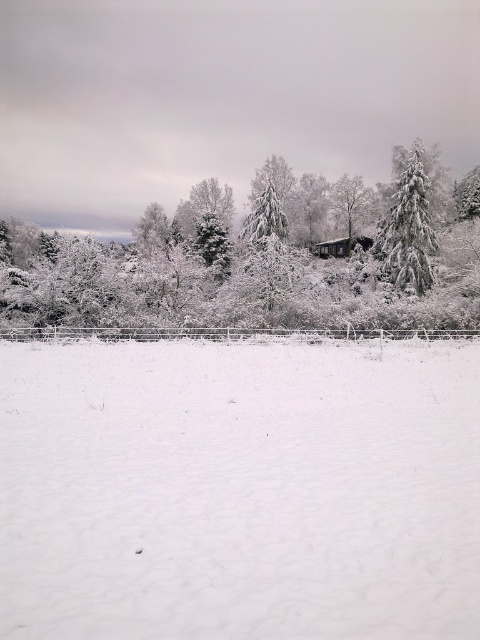
Question: Which point is closer to the camera?

Choices:
 (A) white frosty tree at upper center
 (B) snow-covered evergreen at right
 (C) white fluffy snow at center

Answer: (C)

Question: Which point is closer to the camera taking this photo?

Choices:
 (A) (427, 244)
 (B) (257, 324)

Answer: (B)

Question: Is white frosty tree at upper center to the right of snow-covered evergreen at right from the viewer's perspective?

Choices:
 (A) no
 (B) yes

Answer: (A)

Question: Is white fluffy snow at center to the left of snow-covered evergreen at right from the viewer's perspective?

Choices:
 (A) no
 (B) yes

Answer: (B)

Question: Which point is farther to the camera?

Choices:
 (A) click(x=388, y=246)
 (B) click(x=349, y=515)
 (C) click(x=304, y=260)

Answer: (C)

Question: Does white fluffy snow at center appear on the left side of white frosty tree at upper center?

Choices:
 (A) no
 (B) yes

Answer: (A)